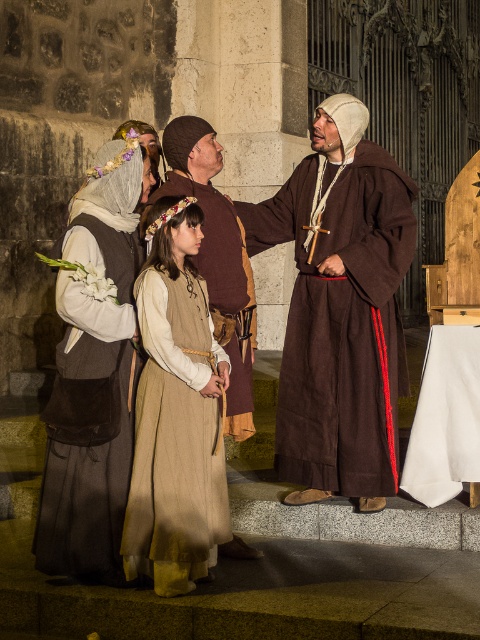
You are an event planner setting up a photo shoot for a historical drama. You need to arrange two main characters wearing the matte brown dress at left and the beige woolen dress at center in a line from left to right. Based on their current positions, which dress should be placed first in the line from the left?

The matte brown dress at left should be placed first in the line from the left since it is already positioned on the left side of the beige woolen dress at center.

You are a photographer taking a picture of the scene. You notice two points marked in the image at coordinates point (404, 269) and point (72, 556). Which point is closer to your camera?

Point (72, 556) is closer to the camera because it is less further than point (404, 269).